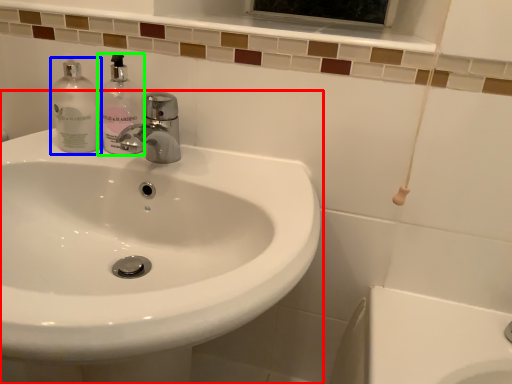
Question: Considering the real-world distances, which object is closest to sink (highlighted by a red box)? cleaning product (highlighted by a blue box) or soap dispenser (highlighted by a green box).

Choices:
 (A) cleaning product
 (B) soap dispenser

Answer: (B)